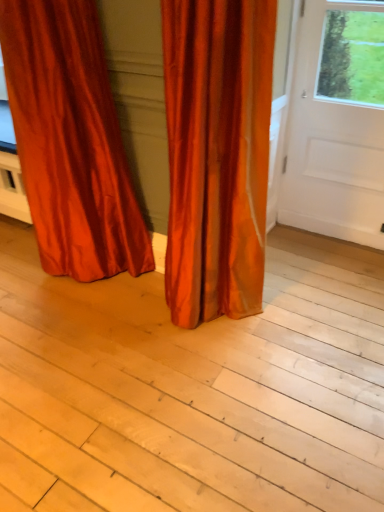
Where is `vacant space in front of satin orange curtain at lower left, which ranks as the 1th curtain in left-to-right order`? vacant space in front of satin orange curtain at lower left, which ranks as the 1th curtain in left-to-right order is located at coordinates (81, 335).